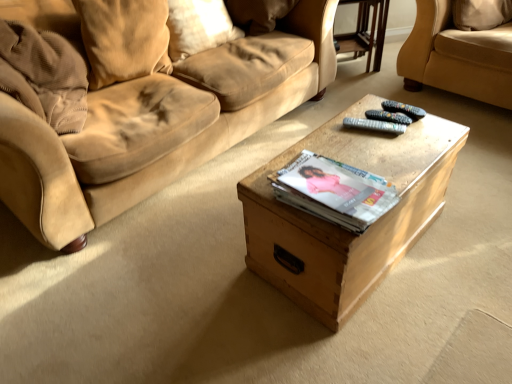
Image resolution: width=512 pixels, height=384 pixels. What do you see at coordinates (403, 109) in the screenshot?
I see `black plastic remote at center, which appears as the second remote when ordered from the bottom` at bounding box center [403, 109].

This screenshot has width=512, height=384. What do you see at coordinates (258, 14) in the screenshot?
I see `suede pillow at upper center, which is counted as the 3th pillow, starting from the left` at bounding box center [258, 14].

Locate an element on the screen. suede beige couch at upper right is located at coordinates (457, 56).

From the image's perspective, is black plastic remote at center, marked as the 1th remote in a bottom-to-top arrangement, on suede beige couch at upper right?

No.

Is black plastic remote at center, marked as the 1th remote in a bottom-to-top arrangement, turned away from suede beige couch at upper right?

No, suede beige couch at upper right is not at the back of black plastic remote at center, marked as the 1th remote in a bottom-to-top arrangement.

I want to click on the 2nd remote to the left of the suede beige couch at upper right, counting from the anchor's position, so click(x=374, y=125).

Between point (349, 122) and point (454, 89), which one is positioned behind?

The point (454, 89) is farther from the camera.

Looking at this image, how far apart are suede pillow at upper left, which is the third pillow in right-to-left order, and matte paper magazine at center?

They are 3.97 feet apart.

From a real-world perspective, is suede pillow at upper left, which is the third pillow in right-to-left order, above or below matte paper magazine at center?

suede pillow at upper left, which is the third pillow in right-to-left order, is above matte paper magazine at center.

Could you tell me if suede pillow at upper left, which appears as the 1th pillow when viewed from the left, is facing matte paper magazine at center?

Yes, suede pillow at upper left, which appears as the 1th pillow when viewed from the left, is oriented towards matte paper magazine at center.

Which object is positioned more to the left, suede pillow at upper left, which appears as the 1th pillow when viewed from the left, or matte paper magazine at center?

suede pillow at upper left, which appears as the 1th pillow when viewed from the left.

Is suede pillow at upper left, which appears as the 1th pillow when viewed from the left, far away from suede beige couch at upper right?

suede pillow at upper left, which appears as the 1th pillow when viewed from the left, is positioned a significant distance from suede beige couch at upper right.

Does suede pillow at upper left, which appears as the 1th pillow when viewed from the left, have a lesser height compared to suede beige couch at upper right?

Yes, suede pillow at upper left, which appears as the 1th pillow when viewed from the left, is shorter than suede beige couch at upper right.

Considering the relative sizes of suede pillow at upper left, which is the third pillow in right-to-left order, and suede beige couch at upper right in the image provided, is suede pillow at upper left, which is the third pillow in right-to-left order, smaller than suede beige couch at upper right?

Correct, suede pillow at upper left, which is the third pillow in right-to-left order, occupies less space than suede beige couch at upper right.

The height and width of the screenshot is (384, 512). I want to click on studio couch that appears above the suede pillow at upper left, which is the third pillow in right-to-left order (from the image's perspective), so click(x=457, y=56).

Choose the correct answer: Is black plastic remote at center, positioned as the first remote in top-to-bottom order, inside wooden box at center or outside it?

black plastic remote at center, positioned as the first remote in top-to-bottom order, is not enclosed by wooden box at center.

Does black plastic remote at center, positioned as the first remote in top-to-bottom order, turn towards wooden box at center?

No, black plastic remote at center, positioned as the first remote in top-to-bottom order, does not turn towards wooden box at center.

Can you confirm if black plastic remote at center, which appears as the second remote when ordered from the bottom, is taller than wooden box at center?

No, black plastic remote at center, which appears as the second remote when ordered from the bottom, is not taller than wooden box at center.

Between black plastic remote at center, which appears as the second remote when ordered from the bottom, and wooden box at center, which one has larger width?

wooden box at center is wider.

Is matte paper magazine at center to the left of transparent glass table at upper center from the viewer's perspective?

Correct, you'll find matte paper magazine at center to the left of transparent glass table at upper center.

Identify the location of glass table below the matte paper magazine at center (from a real-world perspective). This screenshot has width=512, height=384. (366, 32).

Is matte paper magazine at center placed right next to transparent glass table at upper center?

matte paper magazine at center and transparent glass table at upper center are not in contact.

This screenshot has height=384, width=512. What are the coordinates of `pillow to the right of suede pillow at upper left, arranged as the 2th pillow when viewed from the right` in the screenshot? It's located at (258, 14).

Which point is more forward, (x=168, y=26) or (x=272, y=19)?

Positioned in front is point (x=168, y=26).

Is suede pillow at upper left, arranged as the 2th pillow when viewed from the right, outside of suede pillow at upper center, which is counted as the 3th pillow, starting from the left?

Yes, suede pillow at upper left, arranged as the 2th pillow when viewed from the right, is located beyond the bounds of suede pillow at upper center, which is counted as the 3th pillow, starting from the left.

Looking at this image, can you tell me how much suede pillow at upper left, positioned as the second pillow in left-to-right order, and suede pillow at upper center, the 1th pillow in the right-to-left sequence, differ in facing direction?

The facing directions of suede pillow at upper left, positioned as the second pillow in left-to-right order, and suede pillow at upper center, the 1th pillow in the right-to-left sequence, are 59 degrees apart.

Which object is positioned more to the right, suede pillow at upper left, which appears as the 1th pillow when viewed from the left, or wooden box at center?

wooden box at center.

From a real-world perspective, is suede pillow at upper left, which is the third pillow in right-to-left order, above or below wooden box at center?

suede pillow at upper left, which is the third pillow in right-to-left order, is above wooden box at center.

In the scene shown: From the image's perspective, would you say suede pillow at upper left, which appears as the 1th pillow when viewed from the left, is positioned over wooden box at center?

Correct, suede pillow at upper left, which appears as the 1th pillow when viewed from the left, appears higher than wooden box at center in the image.

You are a GUI agent. You are given a task and a screenshot of the screen. Output one action in this format:
    pyautogui.click(x=<x>, y=<y>)
    Task: Click on the studio couch beneath the black plastic remote at center, arranged as the second remote when viewed from the top (from a real-world perspective)
    This screenshot has width=512, height=384.
    Given the screenshot: What is the action you would take?
    point(457,56)

At what (x,y) coordinates should I click in order to perform the action: click on paperback book below the suede pillow at upper left, which is the third pillow in right-to-left order (from the image's perspective). Please return your answer as a coordinate pair (x, y). The width and height of the screenshot is (512, 384). Looking at the image, I should click on (334, 191).

Based on their spatial positions, is suede beige couch at upper right or transparent glass table at upper center closer to matte paper magazine at center?

The object closer to matte paper magazine at center is suede beige couch at upper right.

Based on their spatial positions, is suede pillow at upper left, which appears as the 1th pillow when viewed from the left, or suede beige couch at upper right further from black plastic remote at center, which appears as the second remote when ordered from the bottom?

suede pillow at upper left, which appears as the 1th pillow when viewed from the left, lies further to black plastic remote at center, which appears as the second remote when ordered from the bottom, than the other object.

Estimate the real-world distances between objects in this image. Which object is further from suede pillow at upper center, the 1th pillow in the right-to-left sequence, wooden box at center or suede pillow at upper left, positioned as the second pillow in left-to-right order?

Based on the image, wooden box at center appears to be further to suede pillow at upper center, the 1th pillow in the right-to-left sequence.

Looking at the image, which one is located further to transparent glass table at upper center, black plastic remote at center, arranged as the second remote when viewed from the top, or suede pillow at upper center, the 1th pillow in the right-to-left sequence?

The object further to transparent glass table at upper center is black plastic remote at center, arranged as the second remote when viewed from the top.

When comparing their distances from matte paper magazine at center, does black plastic remote at center, which appears as the second remote when ordered from the bottom, or suede beige couch at upper right seem closer?

Among the two, black plastic remote at center, which appears as the second remote when ordered from the bottom, is located nearer to matte paper magazine at center.

From the image, which object appears to be farther from suede beige couch at upper right, transparent glass table at upper center or matte paper magazine at center?

matte paper magazine at center is further to suede beige couch at upper right.

Based on their spatial positions, is black plastic remote at center, marked as the 1th remote in a bottom-to-top arrangement, or suede pillow at upper left, which appears as the 1th pillow when viewed from the left, closer to suede beige couch at upper right?

black plastic remote at center, marked as the 1th remote in a bottom-to-top arrangement, is positioned closer to the anchor suede beige couch at upper right.

When comparing their distances from suede beige couch at upper right, does suede pillow at upper left, arranged as the 2th pillow when viewed from the right, or matte paper magazine at center seem closer?

suede pillow at upper left, arranged as the 2th pillow when viewed from the right, is positioned closer to the anchor suede beige couch at upper right.

Find the location of a particular element. This screenshot has height=384, width=512. remote situated between black plastic remote at center, arranged as the second remote when viewed from the top, and suede beige couch at upper right from left to right is located at coordinates (403, 109).

The image size is (512, 384). I want to click on table located between matte paper magazine at center and transparent glass table at upper center in the depth direction, so click(341, 228).

Image resolution: width=512 pixels, height=384 pixels. Identify the location of studio couch between black plastic remote at center, positioned as the first remote in top-to-bottom order, and transparent glass table at upper center from front to back. (457, 56).

Where is `remote between suede pillow at upper center, which is counted as the 3th pillow, starting from the left, and black plastic remote at center, marked as the 1th remote in a bottom-to-top arrangement, in the up-down direction`? remote between suede pillow at upper center, which is counted as the 3th pillow, starting from the left, and black plastic remote at center, marked as the 1th remote in a bottom-to-top arrangement, in the up-down direction is located at coordinates (403, 109).